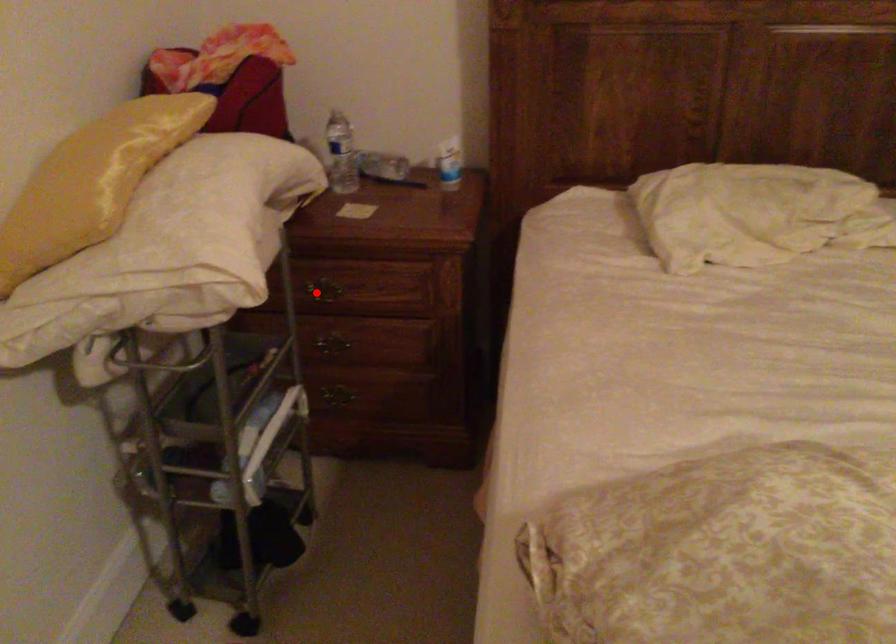
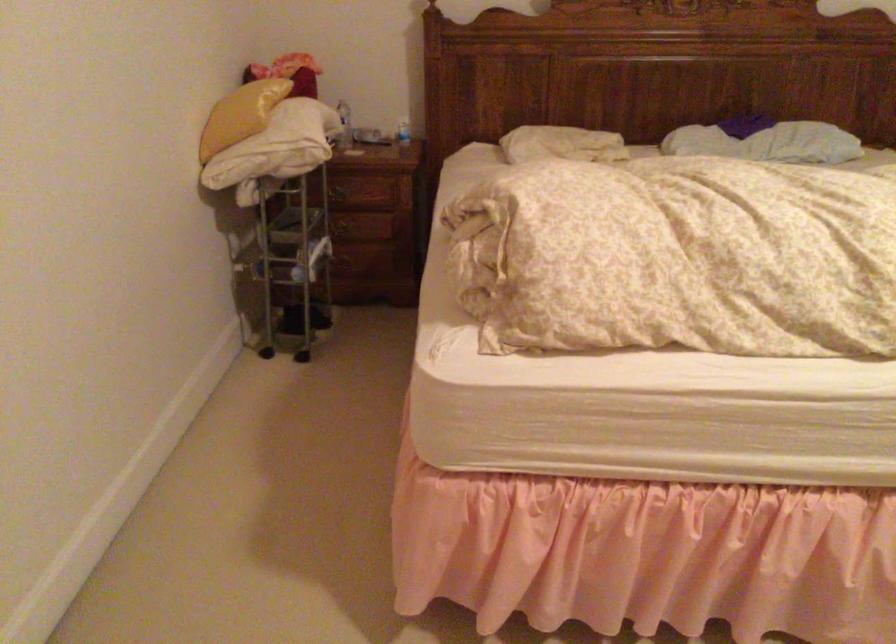
In the second image, find the point that corresponds to the highlighted location in the first image.

(338, 194)